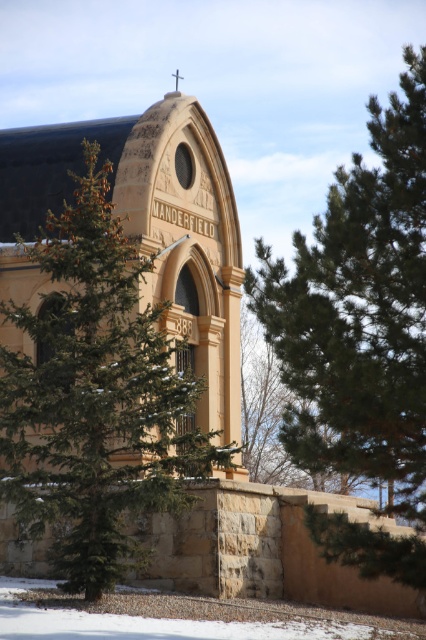
Between point (0, 424) and point (279, 435), which one is positioned in front?

Point (0, 424)

The image size is (426, 640). I want to click on green textured pine tree at center, so click(x=95, y=396).